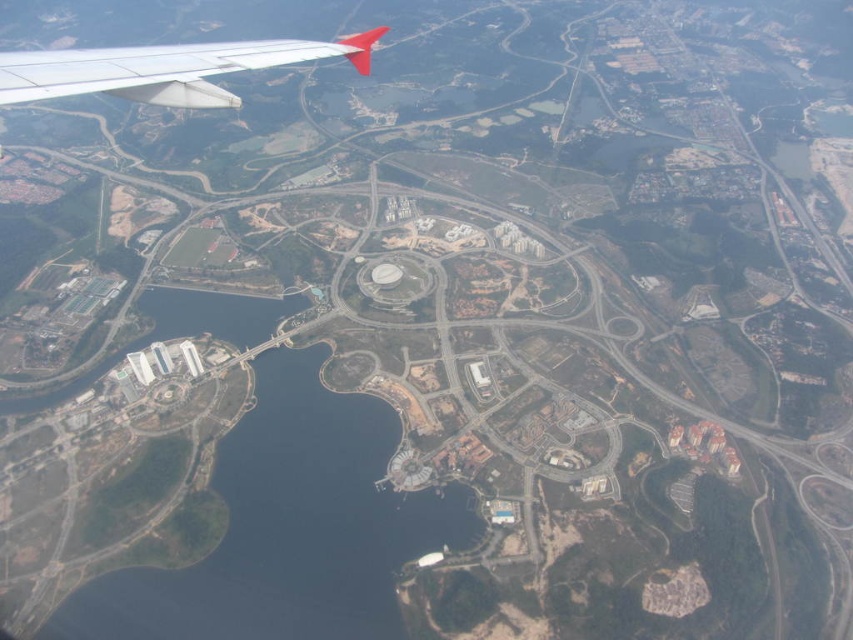
Question: Which of the following is the farthest from the observer?

Choices:
 (A) (216, 52)
 (B) (329, 573)

Answer: (B)

Question: Can you confirm if blue water at center is thinner than white matte wing at upper left?

Choices:
 (A) no
 (B) yes

Answer: (A)

Question: Does blue water at center appear over white matte wing at upper left?

Choices:
 (A) no
 (B) yes

Answer: (A)

Question: Which object is closer to the camera taking this photo?

Choices:
 (A) blue water at center
 (B) white matte wing at upper left

Answer: (B)

Question: Does blue water at center lie behind white matte wing at upper left?

Choices:
 (A) no
 (B) yes

Answer: (B)

Question: Which point is closer to the camera taking this photo?

Choices:
 (A) (281, 396)
 (B) (196, 67)

Answer: (B)